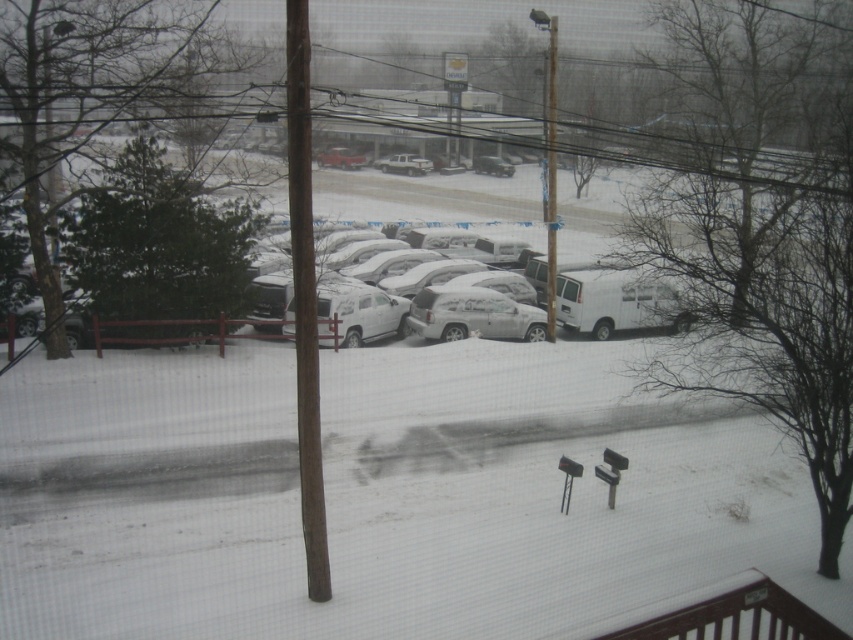
Question: Does white matte suv at center have a greater width compared to satin silver suv at center?

Choices:
 (A) yes
 (B) no

Answer: (A)

Question: Does matte silver suv at center come behind satin silver suv at center?

Choices:
 (A) yes
 (B) no

Answer: (B)

Question: Which of the following is the farthest from the observer?

Choices:
 (A) satin silver suv at center
 (B) metallic pole at center

Answer: (A)

Question: Does white matte suv at center appear on the left side of matte silver suv at center?

Choices:
 (A) no
 (B) yes

Answer: (A)

Question: Which point is closer to the camera taking this photo?

Choices:
 (A) (554, 156)
 (B) (299, 147)

Answer: (B)

Question: Estimate the real-world distances between objects in this image. Which object is closer to the matte silver suv at center?

Choices:
 (A) satin silver suv at center
 (B) white matte van at center
 (C) white matte suv at center

Answer: (B)